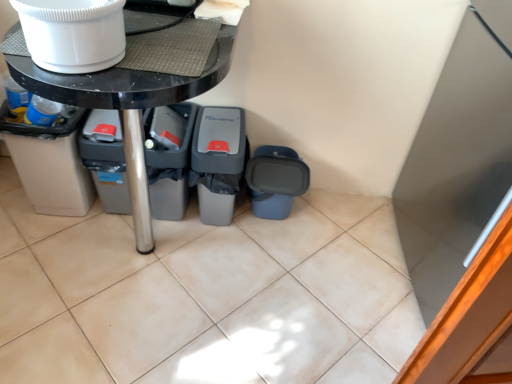
Identify the location of vacant area that is in front of beige plastic recycling bin at lower left, placed as the first recycling bin when sorted from left to right. (49, 241).